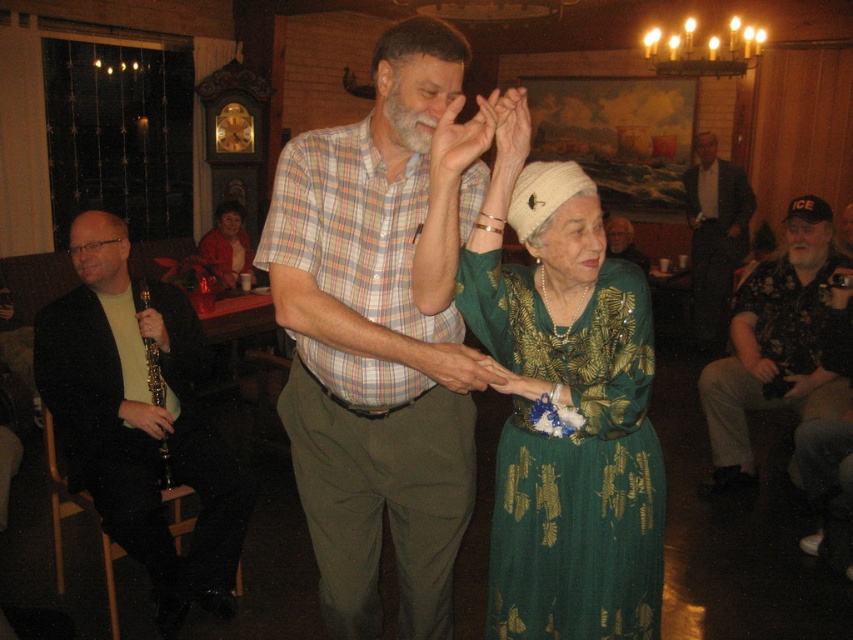
You are a photographer at the event and want to capture a photo of the black matte clarinet at left and the dark gray suit at right in the same frame. Which object should you focus on first if you want to ensure both are in focus?

The black matte clarinet at left has a lesser height compared to dark gray suit at right, so you should focus on the dark gray suit at right first to ensure both are in focus.

You are a photographer standing at the back of the room. You want to take a photo that includes both the dark gray suit at right and the gray hair at center. The camera you are using has a maximum focus range of 20 inches. Can you capture both subjects in focus without moving closer?

The distance between the dark gray suit at right and gray hair at center is 22.44 inches, which exceeds the camera maximum focus range of 20 inches. Therefore, you cannot capture both subjects in focus without moving closer.